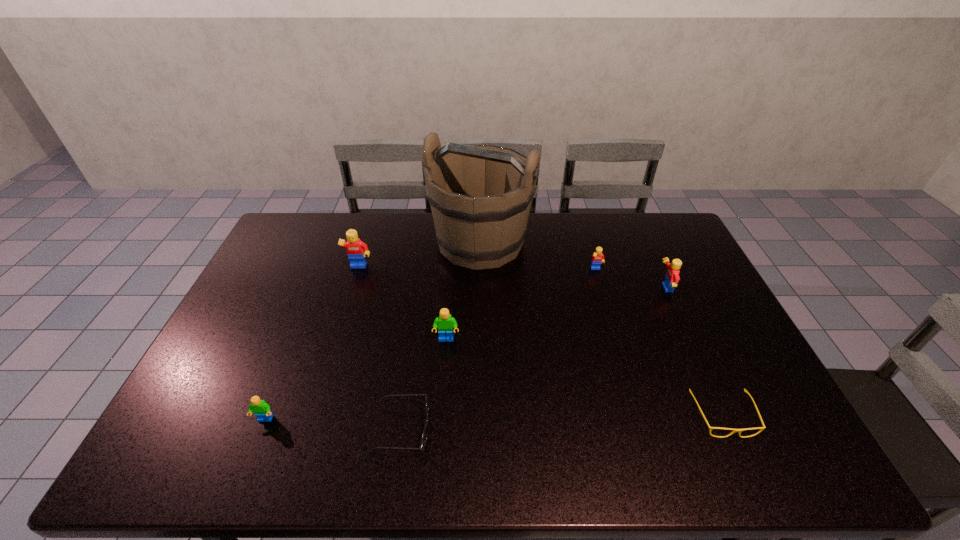
Identify the location of free spot between the leftmost object and the bucket. This screenshot has height=540, width=960. (372, 331).

Image resolution: width=960 pixels, height=540 pixels. Find the location of `unoccupied area between the right spectacles and the sixth object from left to right`. unoccupied area between the right spectacles and the sixth object from left to right is located at coordinates (660, 343).

The image size is (960, 540). What are the coordinates of `free space between the left green Lego and the second nearest Lego` in the screenshot? It's located at (356, 380).

What are the coordinates of `unoccupied position between the bucket and the leftmost Lego` in the screenshot? It's located at (372, 331).

I want to click on empty space that is in between the bucket and the biggest yellow Lego, so click(420, 255).

Where is `blank region between the fourth nearest object and the second yellow Lego from left to right`? The width and height of the screenshot is (960, 540). blank region between the fourth nearest object and the second yellow Lego from left to right is located at coordinates (521, 305).

Locate an element on the screen. vacant space that is in between the bucket and the rightmost Lego is located at coordinates (572, 265).

You are a GUI agent. You are given a task and a screenshot of the screen. Output one action in this format:
    pyautogui.click(x=<x>, y=<y>)
    Task: Click on the free area in between the smaller green Lego and the right green Lego
    Image resolution: width=960 pixels, height=540 pixels.
    Given the screenshot: What is the action you would take?
    point(356,380)

This screenshot has width=960, height=540. Find the location of `free space between the third nearest Lego and the beige spectacles`. free space between the third nearest Lego and the beige spectacles is located at coordinates (693, 352).

Select which object appears as the sixth closest to the leftmost object. Please provide its 2D coordinates. Your answer should be formatted as a tuple, i.e. [(x, y)], where the tuple contains the x and y coordinates of a point satisfying the conditions above.

[(711, 428)]